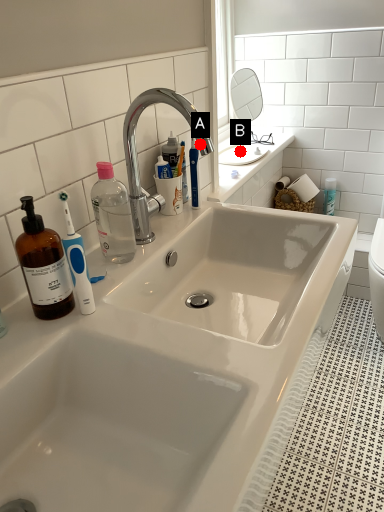
Question: Two points are circled on the image, labeled by A and B beside each circle. Which point is closer to the camera?

Choices:
 (A) A is closer
 (B) B is closer

Answer: (A)